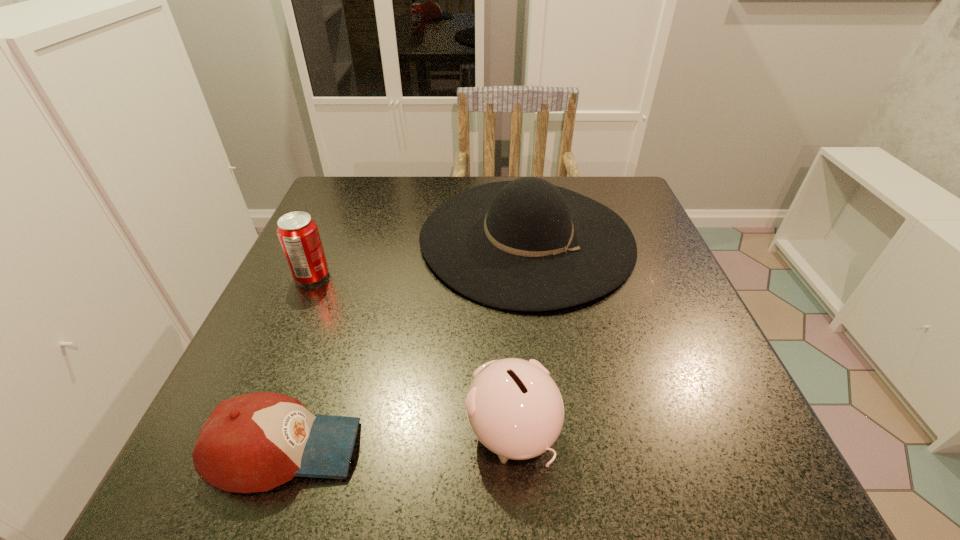
Where is `baseball cap present at the near edge`? baseball cap present at the near edge is located at coordinates (254, 442).

Identify the location of soda that is at the left edge. tap(298, 234).

Where is `baseball cap positioned at the left edge`? This screenshot has height=540, width=960. baseball cap positioned at the left edge is located at coordinates (254, 442).

Locate an element on the screen. object at the right edge is located at coordinates pyautogui.click(x=527, y=245).

Identify the location of object that is at the near left corner. This screenshot has height=540, width=960. (254, 442).

This screenshot has width=960, height=540. What are the coordinates of `object at the far right corner` in the screenshot? It's located at (527, 245).

In order to click on vacant area at the far edge of the desktop in this screenshot , I will do `click(383, 214)`.

The image size is (960, 540). In the image, there is a desktop. What are the coordinates of `free space at the left edge` in the screenshot? It's located at (241, 372).

You are a GUI agent. You are given a task and a screenshot of the screen. Output one action in this format:
    pyautogui.click(x=<x>, y=<y>)
    Task: Click on the free location at the right edge
    
    Given the screenshot: What is the action you would take?
    pyautogui.click(x=688, y=401)

Locate an element on the screen. The width and height of the screenshot is (960, 540). vacant space at the far left corner of the desktop is located at coordinates (371, 205).